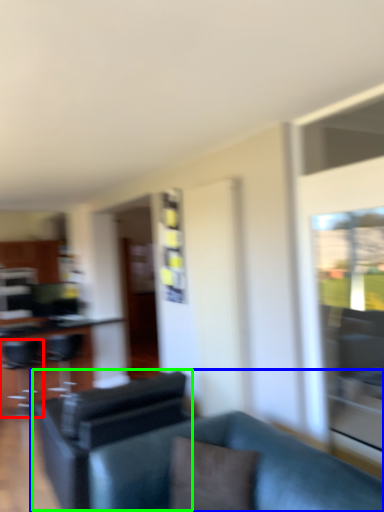
Question: Considering the real-world distances, which object is farthest from swivel chair (highlighted by a red box)? studio couch (highlighted by a blue box) or swivel chair (highlighted by a green box)?

Choices:
 (A) studio couch
 (B) swivel chair

Answer: (A)